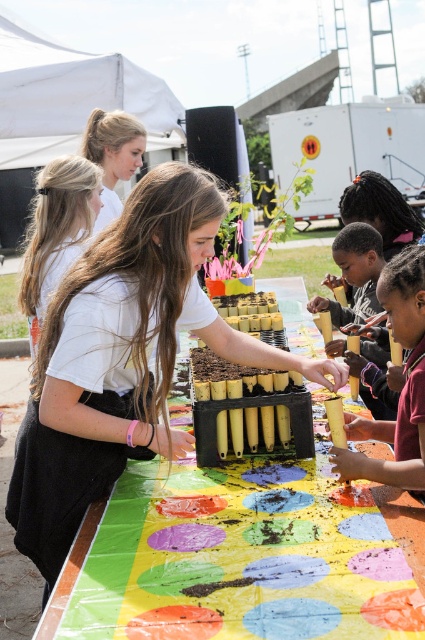
Question: Which point is closer to the camera taking this photo?

Choices:
 (A) (104, 262)
 (B) (413, 259)

Answer: (A)

Question: Among these points, which one is farthest from the camera?

Choices:
 (A) (322, 362)
 (B) (351, 428)

Answer: (B)

Question: Does white matte shirt at center appear under matte yellow pencil at center?

Choices:
 (A) yes
 (B) no

Answer: (A)

Question: Can you confirm if white matte shirt at center is positioned below matte yellow pencil at center?

Choices:
 (A) yes
 (B) no

Answer: (A)

Question: Is white matte shirt at center positioned at the back of matte yellow pencil at center?

Choices:
 (A) no
 (B) yes

Answer: (B)